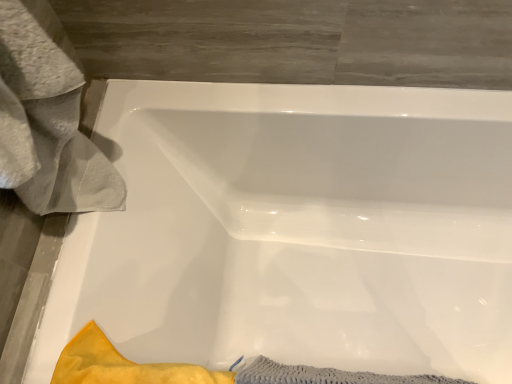
The image size is (512, 384). I want to click on yellow fabric towel at lower left, so pos(122,365).

The image size is (512, 384). What do you see at coordinates (122, 365) in the screenshot?
I see `yellow fabric towel at lower left` at bounding box center [122, 365].

Identify the location of yellow fabric towel at lower left. The image size is (512, 384). (122, 365).